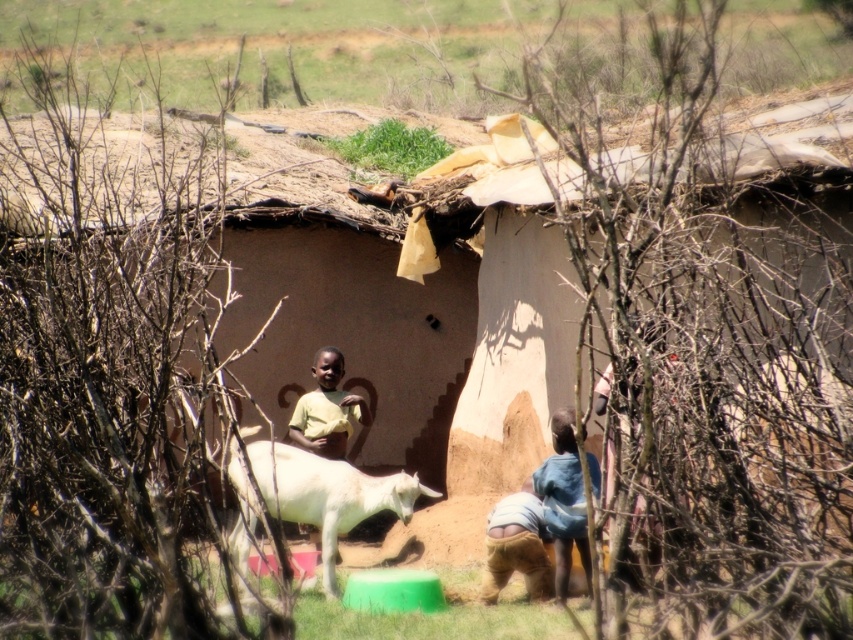
Question: Can you confirm if white matte goat at center is wider than yellow matte shirt at center?

Choices:
 (A) no
 (B) yes

Answer: (B)

Question: Which object is the farthest from the white matte goat at center?

Choices:
 (A) yellow matte shirt at center
 (B) blue denim skirt at lower right

Answer: (A)

Question: Does white matte goat at center have a smaller size compared to blue denim skirt at lower right?

Choices:
 (A) yes
 (B) no

Answer: (B)

Question: Which object is farther from the camera taking this photo?

Choices:
 (A) blue denim skirt at lower right
 (B) white matte goat at center

Answer: (B)

Question: Can you confirm if white matte goat at center is positioned above blue denim skirt at lower right?

Choices:
 (A) no
 (B) yes

Answer: (B)

Question: Which point is farther to the camera?

Choices:
 (A) (401, 499)
 (B) (299, 429)
 (C) (555, 428)

Answer: (B)